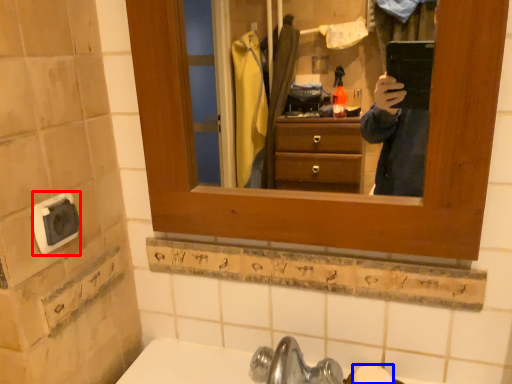
Question: Which object is further to the camera taking this photo, knob (highlighted by a red box) or soap (highlighted by a blue box)?

Choices:
 (A) knob
 (B) soap

Answer: (B)